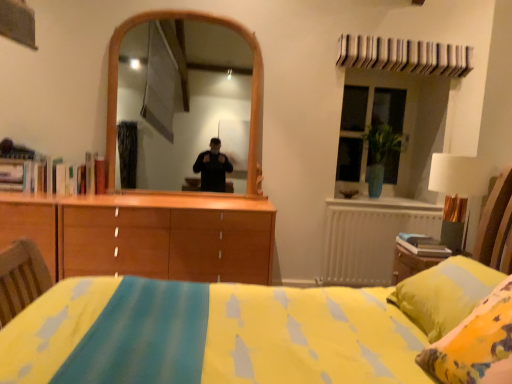
Locate an element on the screen. white metallic radiator at right is located at coordinates click(370, 237).

Locate an element on the screen. The height and width of the screenshot is (384, 512). white fabric lampshade at right is located at coordinates (459, 175).

Considering the relative sizes of green glass vase at upper right and white metallic radiator at right in the image provided, is green glass vase at upper right thinner than white metallic radiator at right?

No.

Is green glass vase at upper right further to the viewer compared to white metallic radiator at right?

That is True.

Is green glass vase at upper right not near white metallic radiator at right?

No, green glass vase at upper right is not far from white metallic radiator at right.

Looking at the image, does white fabric lampshade at right seem bigger or smaller compared to white metallic radiator at right?

Clearly, white fabric lampshade at right is smaller in size than white metallic radiator at right.

Considering their positions, is white fabric lampshade at right located in front of or behind white metallic radiator at right?

Clearly, white fabric lampshade at right is in front of white metallic radiator at right.

Is white fabric lampshade at right looking in the opposite direction of white metallic radiator at right?

That's not correct — white fabric lampshade at right is not looking away from white metallic radiator at right.

Between white fabric lampshade at right and white metallic radiator at right, which one appears on the right side from the viewer's perspective?

From the viewer's perspective, white fabric lampshade at right appears more on the right side.

From a real-world perspective, is white fabric lampshade at right over green glass vase at upper right?

No, from a real-world perspective, white fabric lampshade at right is not above green glass vase at upper right.

Considering the relative sizes of white fabric lampshade at right and green glass vase at upper right in the image provided, is white fabric lampshade at right wider than green glass vase at upper right?

Yes, white fabric lampshade at right is wider than green glass vase at upper right.

At what (x,y) coordinates should I click in order to perform the action: click on window that appears behind the white fabric lampshade at right. Please return your answer as a coordinate pair (x, y). This screenshot has width=512, height=384. Looking at the image, I should click on (x=365, y=125).

Would you say green glass vase at upper right contains white fabric lampshade at right?

No, white fabric lampshade at right is not a part of green glass vase at upper right.

Is green glass vase at upper right taller or shorter than white fabric lampshade at right?

Clearly, green glass vase at upper right is taller compared to white fabric lampshade at right.

From a real-world perspective, is white metallic radiator at right physically below green glass vase at upper right?

Yes, from a real-world perspective, white metallic radiator at right is beneath green glass vase at upper right.

Can you confirm if white metallic radiator at right is smaller than green glass vase at upper right?

Indeed, white metallic radiator at right has a smaller size compared to green glass vase at upper right.

Does white metallic radiator at right have a greater height compared to green glass vase at upper right?

Incorrect, the height of white metallic radiator at right is not larger of that of green glass vase at upper right.

Can you tell me how much white metallic radiator at right and green glass vase at upper right differ in facing direction?

The angular difference between white metallic radiator at right and green glass vase at upper right is 0.317 degrees.

Which point is more distant from viewer, (380,256) or (433,154)?

The point (380,256) is more distant.

Which object is wider, white metallic radiator at right or white fabric lampshade at right?

white fabric lampshade at right.

From a real-world perspective, is white metallic radiator at right beneath white fabric lampshade at right?

Indeed, from a real-world perspective, white metallic radiator at right is positioned beneath white fabric lampshade at right.

Is white metallic radiator at right directly adjacent to white fabric lampshade at right?

white metallic radiator at right is not next to white fabric lampshade at right, and they're not touching.

You are a GUI agent. You are given a task and a screenshot of the screen. Output one action in this format:
    pyautogui.click(x=<x>, y=<y>)
    Task: Click on the radiator below the green glass vase at upper right (from a real-world perspective)
    
    Given the screenshot: What is the action you would take?
    coord(370,237)

At what (x,y) coordinates should I click in order to perform the action: click on radiator below the white fabric lampshade at right (from the image's perspective). Please return your answer as a coordinate pair (x, y). The width and height of the screenshot is (512, 384). Looking at the image, I should click on (370, 237).

From the image, which object appears to be farther from white metallic radiator at right, green glass vase at upper right or white fabric lampshade at right?

Based on the image, white fabric lampshade at right appears to be further to white metallic radiator at right.

Which object lies further to the anchor point green glass vase at upper right, white fabric lampshade at right or white metallic radiator at right?

Based on the image, white fabric lampshade at right appears to be further to green glass vase at upper right.

Looking at this image, which object lies nearer to the anchor point white metallic radiator at right, white fabric lampshade at right or green glass vase at upper right?

green glass vase at upper right is closer to white metallic radiator at right.

From the picture: Based on their spatial positions, is white metallic radiator at right or green glass vase at upper right further from white fabric lampshade at right?

The object further to white fabric lampshade at right is green glass vase at upper right.

Estimate the real-world distances between objects in this image. Which object is further from white fabric lampshade at right, green glass vase at upper right or white metallic radiator at right?

green glass vase at upper right.

When comparing their distances from green glass vase at upper right, does white metallic radiator at right or white fabric lampshade at right seem closer?

white metallic radiator at right.

The image size is (512, 384). I want to click on radiator between white fabric lampshade at right and green glass vase at upper right from front to back, so click(x=370, y=237).